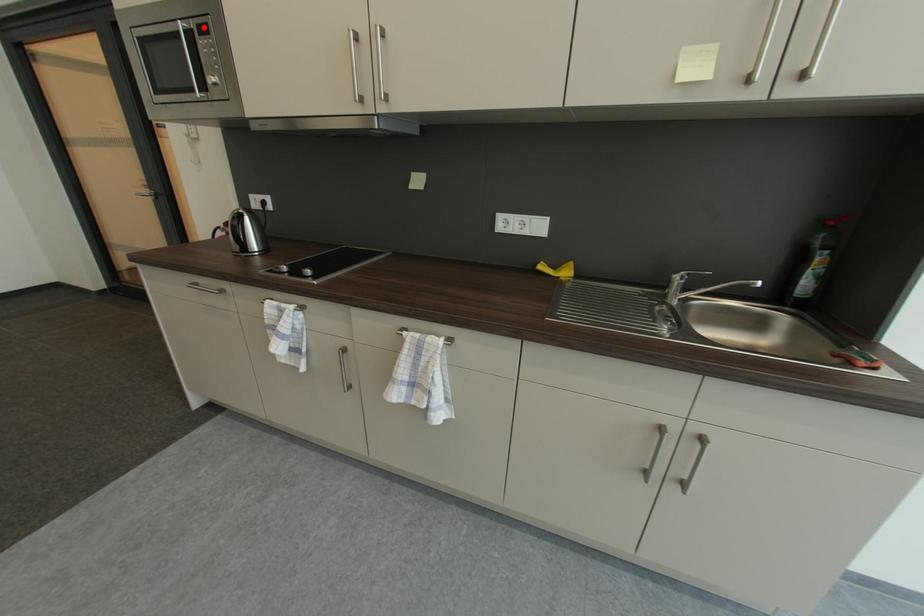
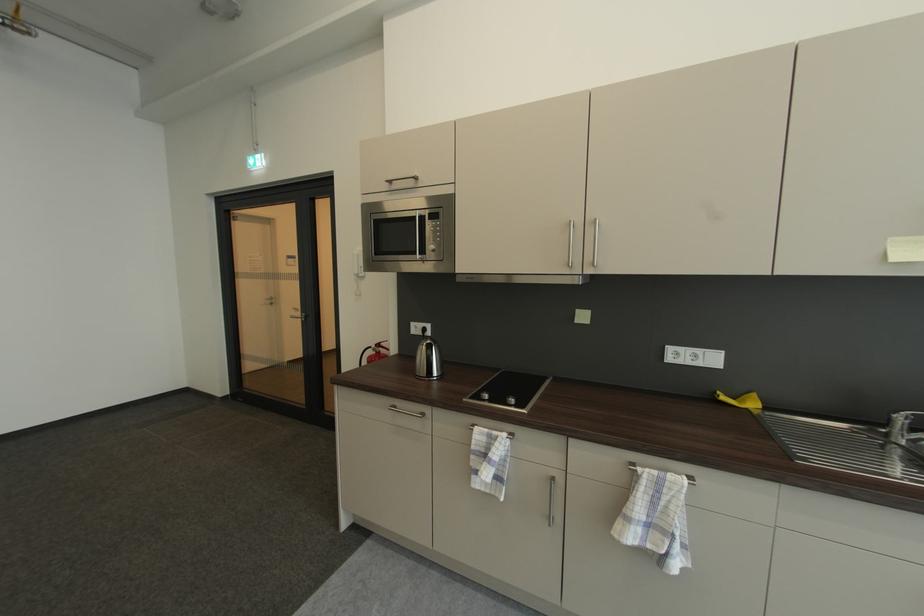
Find the pixel in the second image that matches the highlighted location in the first image.

(436, 215)